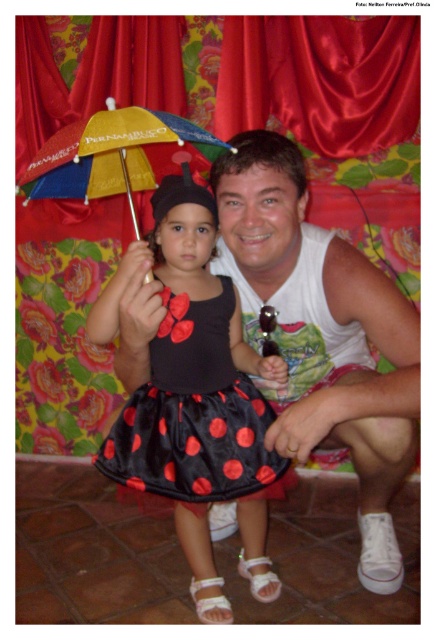
Looking at this image, is white cotton tank top at center shorter than multicolored fabric umbrella at upper left?

In fact, white cotton tank top at center may be taller than multicolored fabric umbrella at upper left.

At what (x,y) coordinates should I click in order to perform the action: click on white cotton tank top at center. Please return your answer as a coordinate pair (x, y). The width and height of the screenshot is (436, 640). Looking at the image, I should click on (322, 333).

Who is taller, white cotton tank top at center or black satin dress at center?

Standing taller between the two is white cotton tank top at center.

How much distance is there between white cotton tank top at center and black satin dress at center?

white cotton tank top at center is 7.34 inches from black satin dress at center.

This screenshot has height=640, width=436. I want to click on white cotton tank top at center, so click(x=322, y=333).

Locate an element on the screen. The width and height of the screenshot is (436, 640). white cotton tank top at center is located at coordinates (322, 333).

Is black satin dress at center positioned behind multicolored fabric umbrella at upper left?

Yes.

Is black satin dress at center wider than multicolored fabric umbrella at upper left?

No, black satin dress at center is not wider than multicolored fabric umbrella at upper left.

Who is more distant from viewer, (145, 444) or (68, 163)?

Point (68, 163)

Locate an element on the screen. The width and height of the screenshot is (436, 640). black satin dress at center is located at coordinates (194, 413).